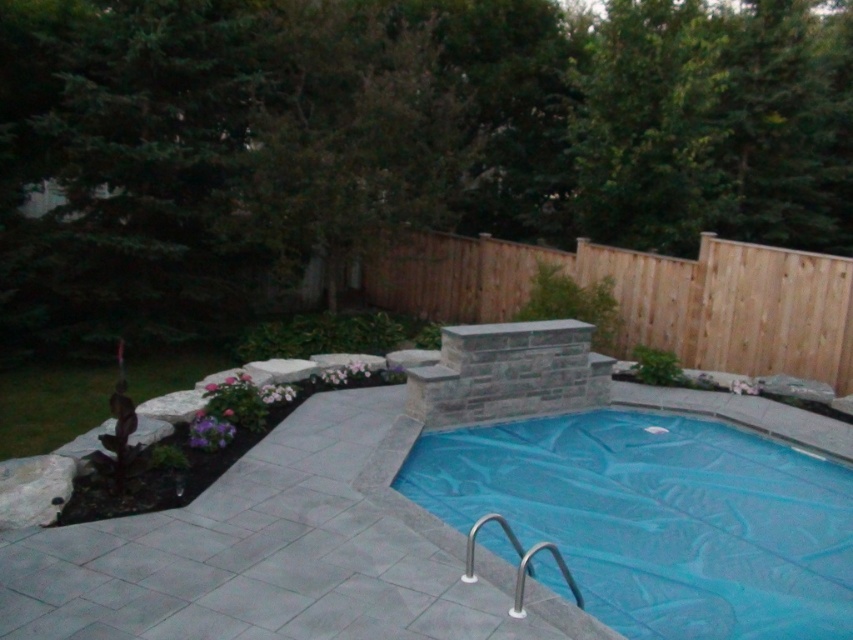
You are planning to install a new lighting system for the blue plastic pool at center and the brown wood fence at center. To ensure proper visibility, you need to know which object is closer to the front of the backyard. Which one is closer?

The blue plastic pool at center is closer to the front of the backyard because it is positioned in front of the brown wood fence at center.

Based on the photo, you are planning to place a new rectangular garden bed that is 3 meters wide in the backyard. The blue plastic pool at center and the brown wood fence at center are already present. Based on their widths, can the garden bed fit between them without overlapping?

The blue plastic pool at center is wider than the brown wood fence at center. Since the garden bed is 3 meters wide, it depends on the actual widths of the pool and fence. However, the description only states their relative sizes, not exact measurements. Therefore, we cannot definitively determine if the garden bed will fit between them without additional information about their specific dimensions.

You are a delivery person trying to place a new 10 feet long wooden bench in the backyard. The bench needs to be placed between the blue plastic pool at center and the brown wood fence at center. Can the bench fit in that space?

The blue plastic pool at center and brown wood fence at center are 19.17 feet apart from each other. Since the bench is 10 feet long, it can easily fit between them as the distance is greater than the bench length.